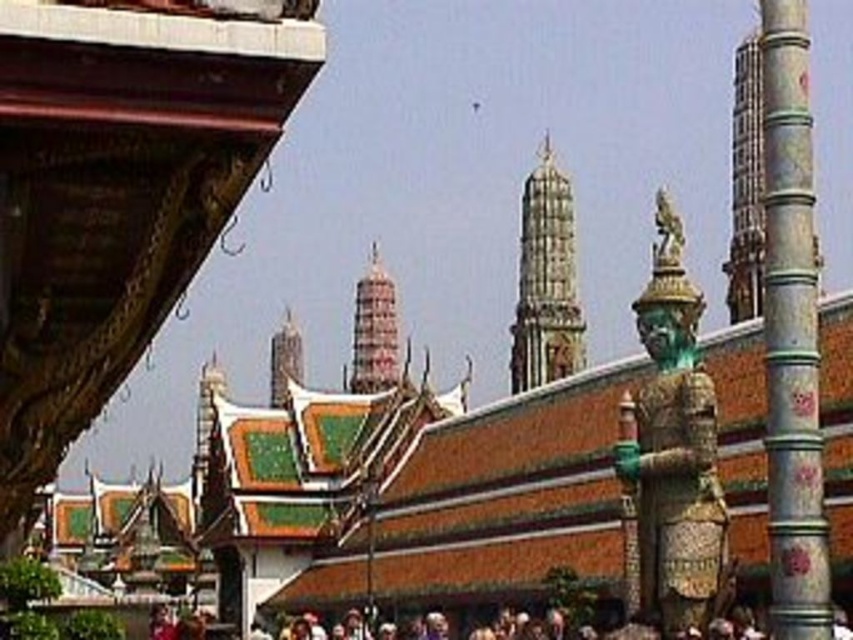
Describe the element at coordinates (791, 333) in the screenshot. The image size is (853, 640). I see `silver metallic column at right` at that location.

Is point (813, 342) farther from viewer compared to point (386, 355)?

No, (813, 342) is closer to viewer.

Where is `silver metallic column at right`? This screenshot has height=640, width=853. silver metallic column at right is located at coordinates pos(791,333).

Does reddish-brown stone temple at center appear over green glazed tile temple at center?

Indeed, reddish-brown stone temple at center is positioned over green glazed tile temple at center.

How far apart are reddish-brown stone temple at center and green glazed tile temple at center?

They are 33.06 meters apart.

Which is behind, point (372, 342) or point (288, 324)?

The point (288, 324) is more distant.

Where is `reddish-brown stone temple at center`? This screenshot has width=853, height=640. reddish-brown stone temple at center is located at coordinates (374, 330).

Which is above, silver metallic column at right or green glazed tile temple at center?

Positioned higher is silver metallic column at right.

Is point (786, 547) less distant than point (292, 316)?

Yes, it is.

The image size is (853, 640). In order to click on silver metallic column at right in this screenshot , I will do `click(791, 333)`.